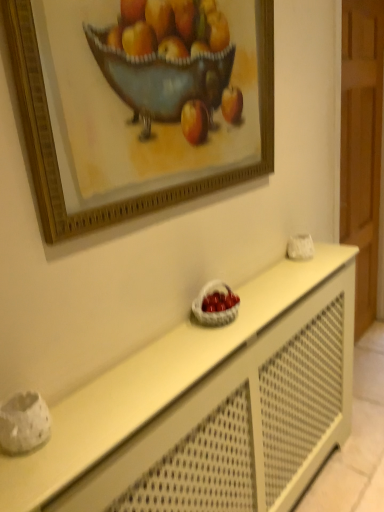
Question: From their relative heights in the image, would you say gold wooden picture frame at upper center is taller or shorter than white matte table at center?

Choices:
 (A) tall
 (B) short

Answer: (B)

Question: Considering the relative positions of gold wooden picture frame at upper center and white matte table at center in the image provided, is gold wooden picture frame at upper center to the left or to the right of white matte table at center?

Choices:
 (A) right
 (B) left

Answer: (B)

Question: Which object is the farthest from the white woven basket at center?

Choices:
 (A) gold wooden picture frame at upper center
 (B) white matte table at center

Answer: (A)

Question: Based on their relative distances, which object is farther from the white woven basket at center?

Choices:
 (A) gold wooden picture frame at upper center
 (B) white matte table at center

Answer: (A)